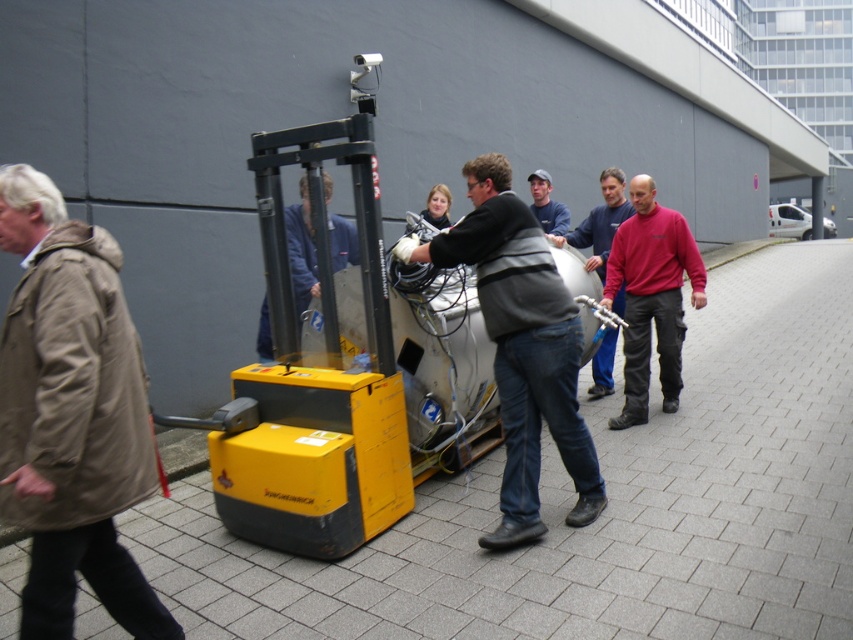
Does blue fabric jacket at center have a lesser width compared to blue denim jeans at center?

No, blue fabric jacket at center is not thinner than blue denim jeans at center.

This screenshot has height=640, width=853. I want to click on blue fabric jacket at center, so click(x=300, y=250).

Which is in front, point (260, 353) or point (538, 186)?

Point (260, 353) is in front.

Find the location of a particular element. The image size is (853, 640). blue fabric jacket at center is located at coordinates (300, 250).

Describe the element at coordinates (521, 346) in the screenshot. I see `dark gray jacket at center` at that location.

Locate an element on the screen. Image resolution: width=853 pixels, height=640 pixels. dark gray jacket at center is located at coordinates (521, 346).

Which of these two, khaki fabric coat at left or blue denim jeans at center, stands shorter?

With less height is blue denim jeans at center.

Between point (74, 561) and point (553, 212), which one is positioned behind?

Point (553, 212)

Identify the location of khaki fabric coat at left. The width and height of the screenshot is (853, 640). (71, 413).